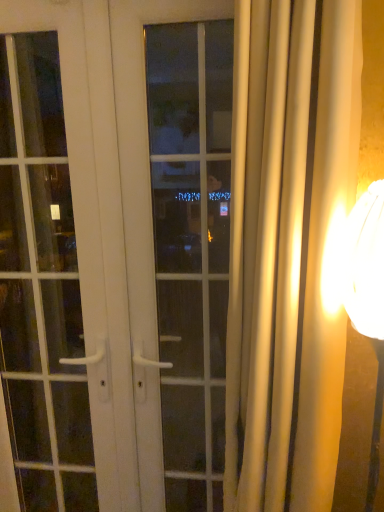
Question: Is white glossy door at center to the left of white glossy door handle at left from the viewer's perspective?

Choices:
 (A) no
 (B) yes

Answer: (A)

Question: Is white glossy door handle at left inside white glossy door at center?

Choices:
 (A) no
 (B) yes

Answer: (B)

Question: Can you confirm if white glossy door at center is taller than white glossy door handle at left?

Choices:
 (A) no
 (B) yes

Answer: (A)

Question: Is white glossy door at center not close to white glossy door handle at left?

Choices:
 (A) no
 (B) yes

Answer: (A)

Question: Considering the relative positions of white glossy door at center and white glossy door handle at left in the image provided, is white glossy door at center in front of white glossy door handle at left?

Choices:
 (A) no
 (B) yes

Answer: (B)

Question: From a real-world perspective, relative to white glossy door at center, is matte gold lampshade at right vertically above or below?

Choices:
 (A) above
 (B) below

Answer: (B)

Question: In the image, is matte gold lampshade at right on the left side or the right side of white glossy door at center?

Choices:
 (A) left
 (B) right

Answer: (B)

Question: Considering the positions of matte gold lampshade at right and white glossy door at center in the image, is matte gold lampshade at right bigger or smaller than white glossy door at center?

Choices:
 (A) big
 (B) small

Answer: (B)

Question: Is matte gold lampshade at right taller or shorter than white glossy door at center?

Choices:
 (A) tall
 (B) short

Answer: (B)

Question: From a real-world perspective, relative to silky beige curtain at right, is white glass window at center vertically above or below?

Choices:
 (A) below
 (B) above

Answer: (A)

Question: Considering the positions of white glass window at center and silky beige curtain at right in the image, is white glass window at center taller or shorter than silky beige curtain at right?

Choices:
 (A) tall
 (B) short

Answer: (A)

Question: Does point (170, 135) appear closer or farther from the camera than point (233, 215)?

Choices:
 (A) closer
 (B) farther

Answer: (B)

Question: In the image, is white glass window at center positioned in front of or behind silky beige curtain at right?

Choices:
 (A) behind
 (B) front

Answer: (A)

Question: From the image's perspective, is matte gold lampshade at right positioned above or below white glossy door handle at left?

Choices:
 (A) below
 (B) above

Answer: (A)

Question: In terms of width, does matte gold lampshade at right look wider or thinner when compared to white glossy door handle at left?

Choices:
 (A) thin
 (B) wide

Answer: (B)